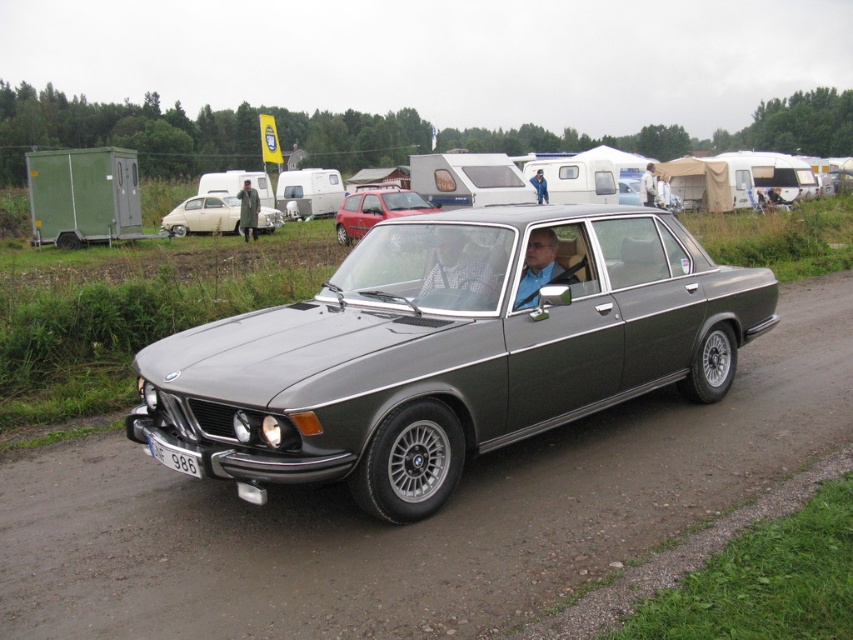
Does gray asphalt road at center appear on the right side of blue fabric jacket at center?

No, gray asphalt road at center is not to the right of blue fabric jacket at center.

Is point (213, 589) behind point (543, 186)?

No, (213, 589) is closer to viewer.

You are a GUI agent. You are given a task and a screenshot of the screen. Output one action in this format:
    pyautogui.click(x=<x>, y=<y>)
    Task: Click on the gray asphalt road at center
    This screenshot has width=853, height=640.
    Given the screenshot: What is the action you would take?
    tap(416, 524)

How much distance is there between satin grey car at center and white fabric jacket at center?

The distance of satin grey car at center from white fabric jacket at center is 22.01 meters.

Is point (601, 237) more distant than point (641, 195)?

No, (601, 237) is in front of (641, 195).

Find the location of a particular element. The height and width of the screenshot is (640, 853). satin grey car at center is located at coordinates (448, 355).

Which of these two, checkered fabric shirt at center or green matte jacket at center, stands shorter?

With less height is checkered fabric shirt at center.

Does checkered fabric shirt at center have a lesser width compared to green matte jacket at center?

Correct, checkered fabric shirt at center's width is less than green matte jacket at center's.

I want to click on checkered fabric shirt at center, so click(457, 266).